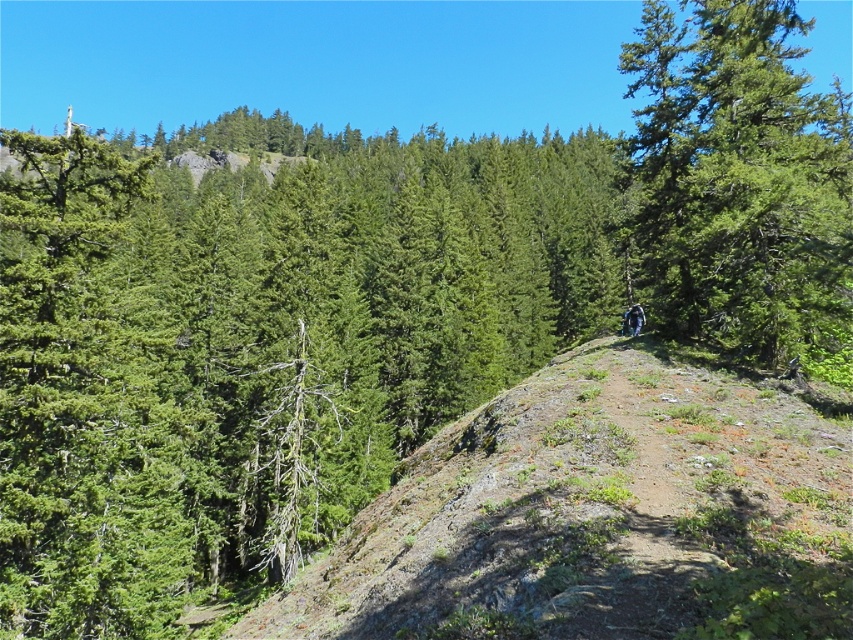
Is green textured tree at upper center to the right of green textured tree at center from the viewer's perspective?

In fact, green textured tree at upper center is to the left of green textured tree at center.

Is green textured tree at upper center below green textured tree at center?

Actually, green textured tree at upper center is above green textured tree at center.

The image size is (853, 640). Identify the location of green textured tree at upper center. (260, 344).

In the scene shown: Who is higher up, dull brown dirt at center or green textured tree at center?

green textured tree at center is above.

Is point (540, 371) farther from camera compared to point (635, 141)?

That is False.

Is point (798, 410) positioned after point (749, 58)?

No.

Image resolution: width=853 pixels, height=640 pixels. I want to click on dull brown dirt at center, so click(x=598, y=516).

Who is shorter, green textured tree at upper center or dull brown dirt at center?

dull brown dirt at center is shorter.

Does point (595, 205) come in front of point (374, 504)?

No, it is not.

Find the location of a particular element. Image resolution: width=853 pixels, height=640 pixels. green textured tree at upper center is located at coordinates (260, 344).